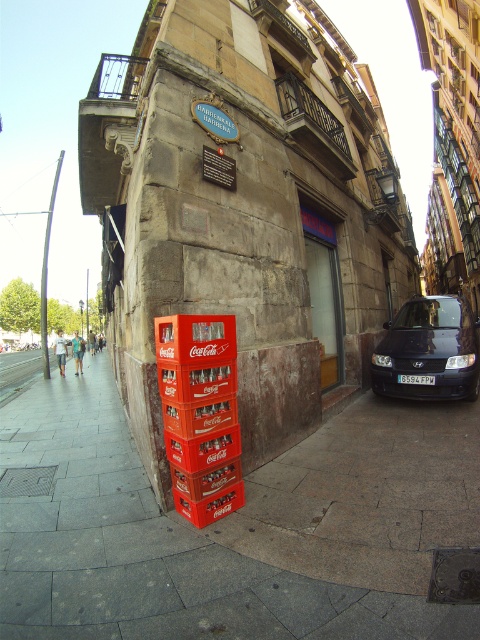
Question: Which object is farther from the camera taking this photo?

Choices:
 (A) dark blue metallic car at right
 (B) smooth concrete pavement at lower center

Answer: (A)

Question: Is smooth concrete pavement at lower center closer to camera compared to dark blue metallic car at right?

Choices:
 (A) no
 (B) yes

Answer: (B)

Question: Can you confirm if smooth concrete pavement at lower center is smaller than dark blue metallic car at right?

Choices:
 (A) yes
 (B) no

Answer: (A)

Question: Does smooth concrete pavement at lower center have a larger size compared to dark blue metallic car at right?

Choices:
 (A) no
 (B) yes

Answer: (A)

Question: Among these points, which one is nearest to the camera?

Choices:
 (A) (475, 380)
 (B) (307, 541)

Answer: (B)